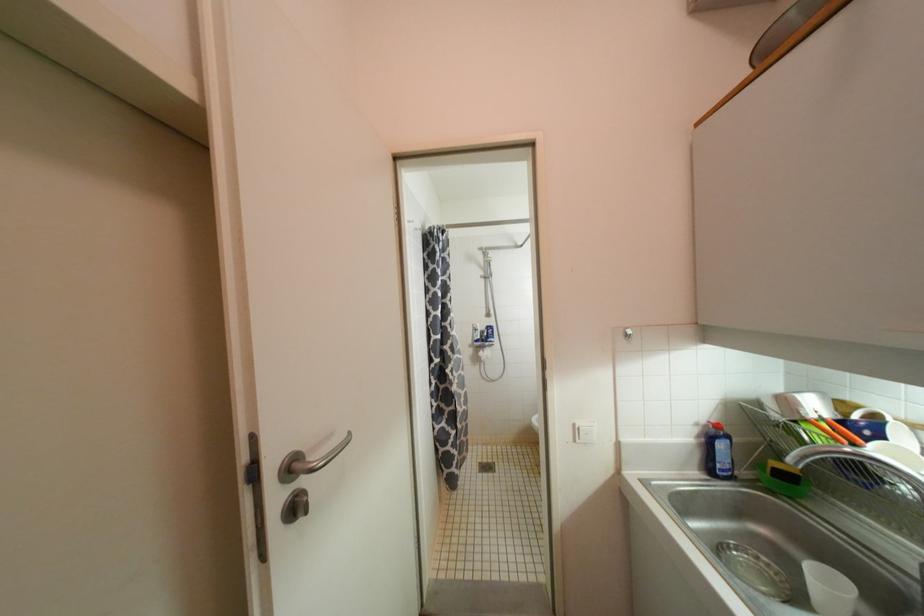
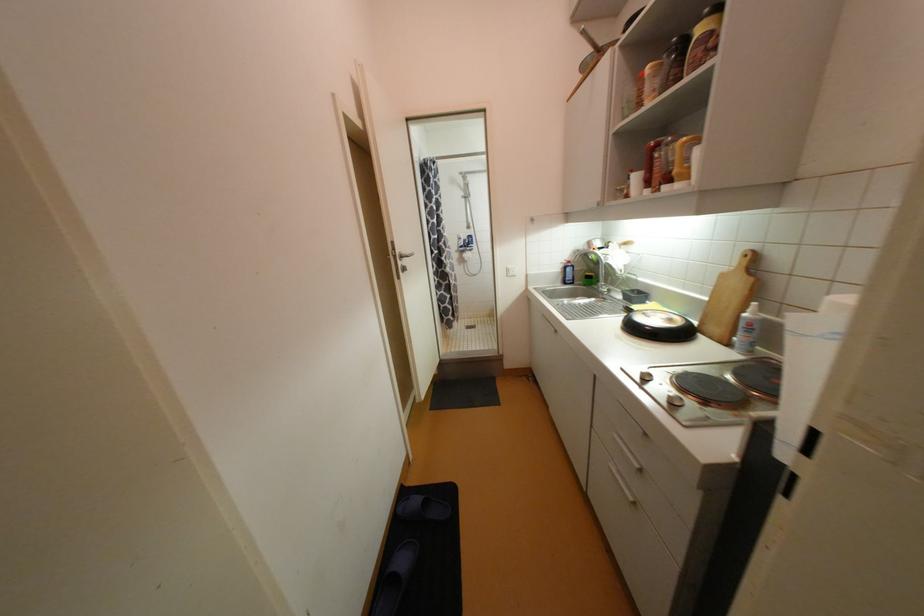
In the second image, find the point that corresponds to [714,471] in the first image.

(569, 283)